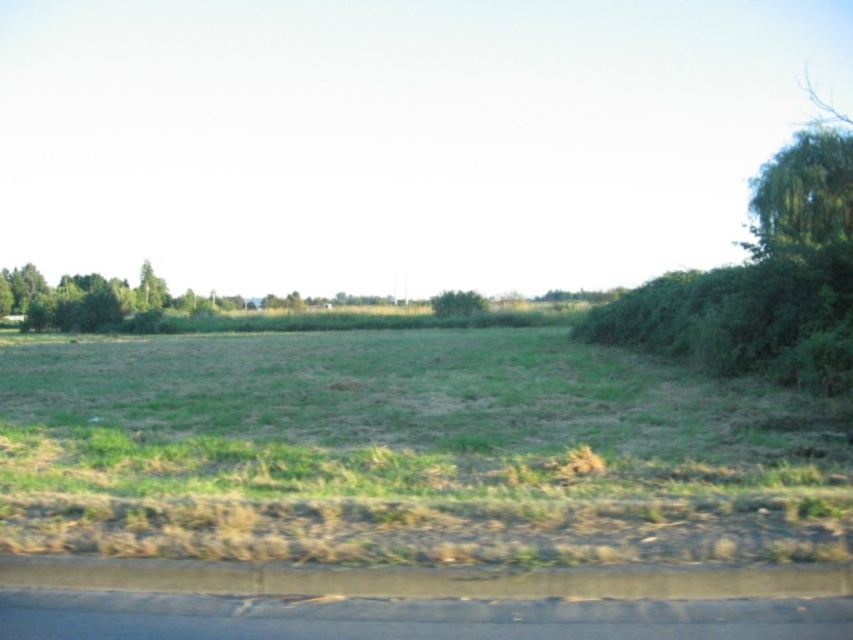
Is green leafy tree at upper right below green leafy tree at center?

Actually, green leafy tree at upper right is above green leafy tree at center.

Is green leafy tree at upper right closer to camera compared to green leafy tree at center?

Yes.

Is point (849, 195) closer to camera compared to point (467, 298)?

Yes, point (849, 195) is closer to viewer.

The width and height of the screenshot is (853, 640). I want to click on green leafy tree at upper right, so click(x=802, y=195).

Can you confirm if green leafy tree at upper right is positioned to the left of green leafy tree at left?

No, green leafy tree at upper right is not to the left of green leafy tree at left.

Can you confirm if green leafy tree at upper right is positioned to the right of green leafy tree at left?

Yes, green leafy tree at upper right is to the right of green leafy tree at left.

You are a GUI agent. You are given a task and a screenshot of the screen. Output one action in this format:
    pyautogui.click(x=<x>, y=<y>)
    Task: Click on the green leafy tree at upper right
    The image size is (853, 640).
    Given the screenshot: What is the action you would take?
    pyautogui.click(x=802, y=195)

Who is taller, green leafy tree at center or green leafy tree at left?

Standing taller between the two is green leafy tree at left.

What do you see at coordinates (457, 304) in the screenshot? The image size is (853, 640). I see `green leafy tree at center` at bounding box center [457, 304].

Is point (456, 312) closer to camera compared to point (142, 308)?

That is True.

You are a GUI agent. You are given a task and a screenshot of the screen. Output one action in this format:
    pyautogui.click(x=<x>, y=<y>)
    Task: Click on the green leafy tree at center
    The image size is (853, 640).
    Given the screenshot: What is the action you would take?
    tap(457, 304)